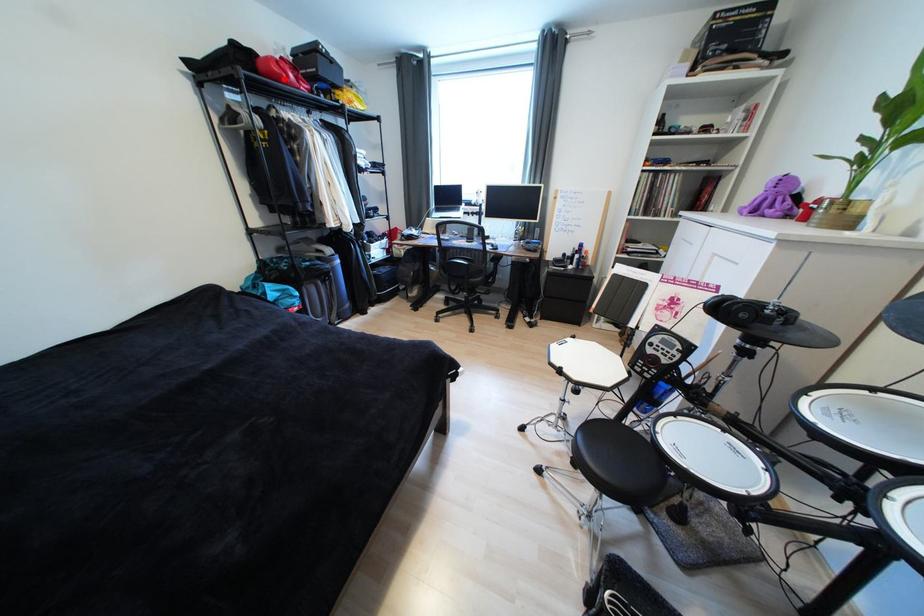
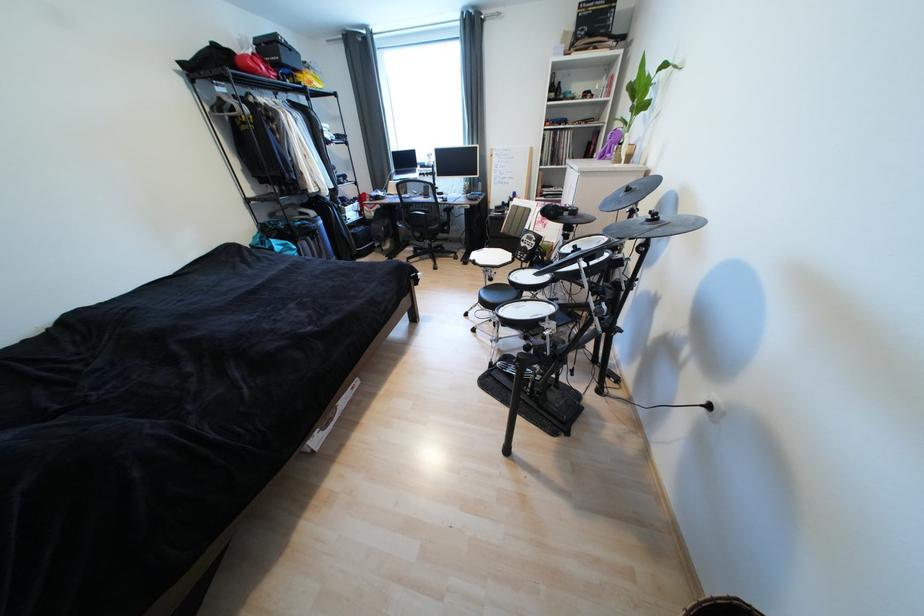
Find the pixel in the second image that matches the highlighted location in the first image.

(261, 73)